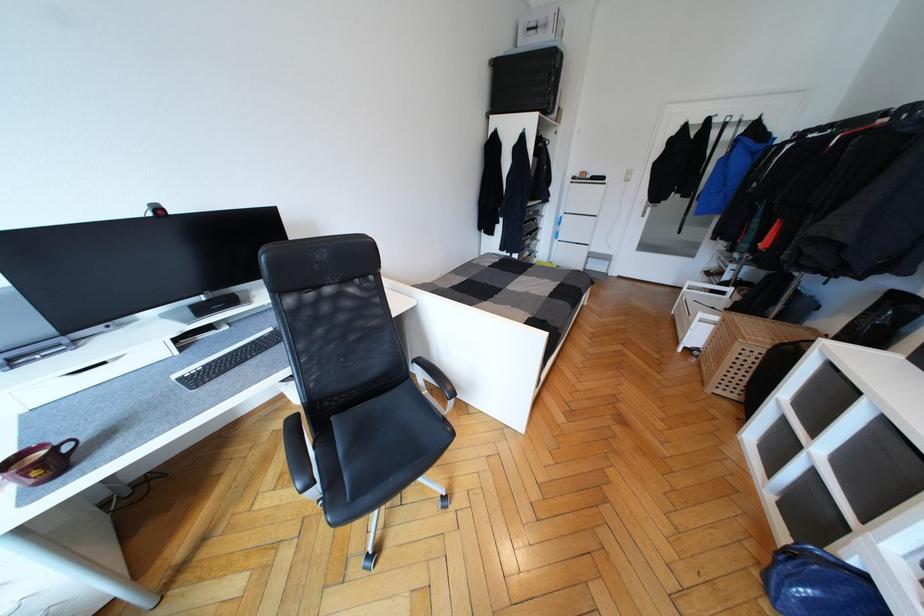
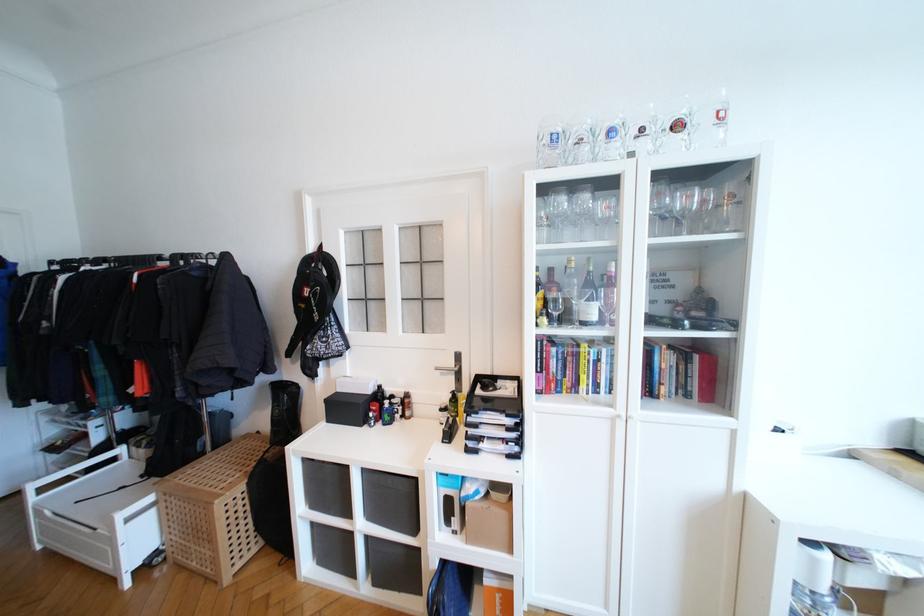
In the second image, find the point that corresponds to (x=725, y=294) in the first image.

(116, 461)